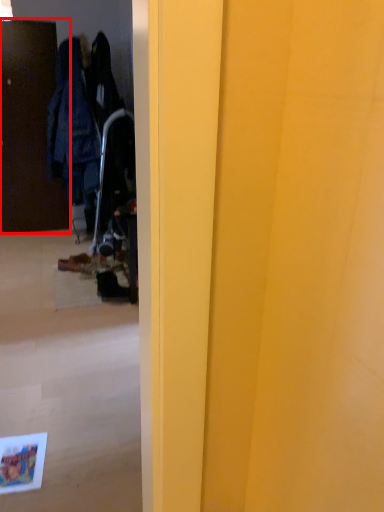
Question: From the image's perspective, what is the correct spatial positioning of door (annotated by the red box) in reference to footwear?

Choices:
 (A) above
 (B) below

Answer: (A)